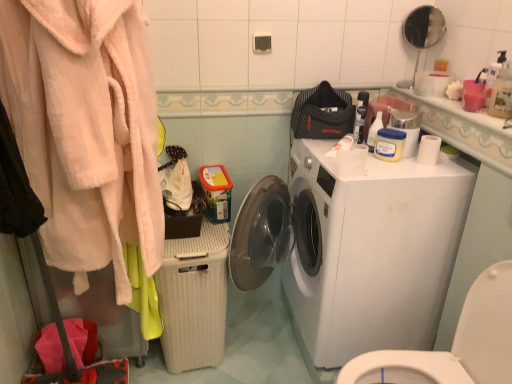
Question: Is soft pink plush robe at left to the left of beige wicker basket at lower center from the viewer's perspective?

Choices:
 (A) no
 (B) yes

Answer: (B)

Question: Is soft pink plush robe at left positioned in front of beige wicker basket at lower center?

Choices:
 (A) no
 (B) yes

Answer: (B)

Question: Is soft pink plush robe at left smaller than beige wicker basket at lower center?

Choices:
 (A) no
 (B) yes

Answer: (A)

Question: From a real-world perspective, is soft pink plush robe at left positioned over beige wicker basket at lower center based on gravity?

Choices:
 (A) yes
 (B) no

Answer: (A)

Question: Is soft pink plush robe at left aimed at beige wicker basket at lower center?

Choices:
 (A) yes
 (B) no

Answer: (B)

Question: Looking at their shapes, would you say beige wicker basket at lower center is wider or thinner than soft pink plush robe at left?

Choices:
 (A) wide
 (B) thin

Answer: (A)

Question: Considering the positions of point (221, 339) and point (46, 99), is point (221, 339) closer or farther from the camera than point (46, 99)?

Choices:
 (A) farther
 (B) closer

Answer: (A)

Question: From a real-world perspective, is beige wicker basket at lower center positioned above or below soft pink plush robe at left?

Choices:
 (A) below
 (B) above

Answer: (A)

Question: Based on their sizes in the image, would you say beige wicker basket at lower center is bigger or smaller than soft pink plush robe at left?

Choices:
 (A) big
 (B) small

Answer: (B)

Question: Looking at their shapes, would you say white plastic washer at right is wider or thinner than white glossy washing machine at center?

Choices:
 (A) thin
 (B) wide

Answer: (A)

Question: Relative to white glossy washing machine at center, is white plastic washer at right in front or behind?

Choices:
 (A) behind
 (B) front

Answer: (B)

Question: Based on their sizes in the image, would you say white plastic washer at right is bigger or smaller than white glossy washing machine at center?

Choices:
 (A) small
 (B) big

Answer: (A)

Question: From a real-world perspective, is white plastic washer at right positioned above or below white glossy washing machine at center?

Choices:
 (A) above
 (B) below

Answer: (B)

Question: Based on their sizes in the image, would you say soft pink plush robe at left is bigger or smaller than white matte toilet paper at upper right?

Choices:
 (A) big
 (B) small

Answer: (A)

Question: Considering the positions of point (98, 61) and point (431, 150), is point (98, 61) closer or farther from the camera than point (431, 150)?

Choices:
 (A) farther
 (B) closer

Answer: (B)